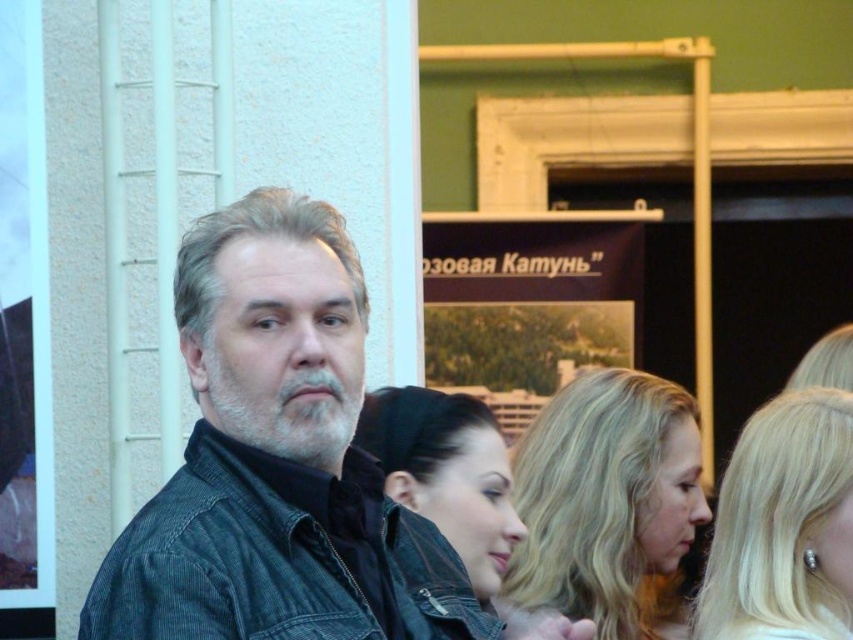
Does blonde hair at upper right have a smaller size compared to smooth black hair at center?

No.

Is point (825, 451) behind point (468, 470)?

No.

This screenshot has height=640, width=853. I want to click on blonde hair at upper right, so click(784, 525).

Does point (335, 445) come closer to viewer compared to point (228, 348)?

No.

Does denim jacket at center have a larger size compared to graywoollybeard at center?

Yes, denim jacket at center is bigger than graywoollybeard at center.

Does point (354, 588) come in front of point (294, 410)?

Yes, point (354, 588) is in front of point (294, 410).

Find the location of a particular element. The height and width of the screenshot is (640, 853). denim jacket at center is located at coordinates (277, 460).

Between point (817, 392) and point (280, 448), which one is positioned behind?

Point (817, 392)

Is blonde hair at upper right below graywoollybeard at center?

Correct, blonde hair at upper right is located below graywoollybeard at center.

Between point (840, 449) and point (347, 384), which one is positioned in front?

Point (347, 384) is in front.

You are a GUI agent. You are given a task and a screenshot of the screen. Output one action in this format:
    pyautogui.click(x=<x>, y=<y>)
    Task: Click on the blonde hair at upper right
    
    Given the screenshot: What is the action you would take?
    pyautogui.click(x=784, y=525)